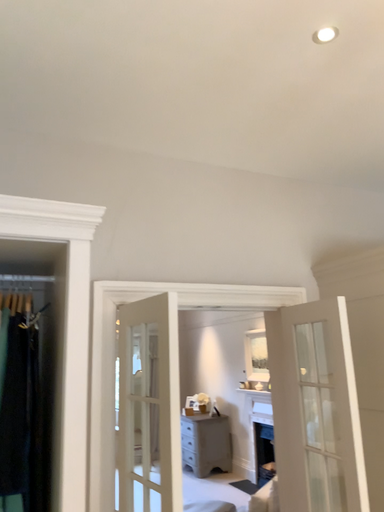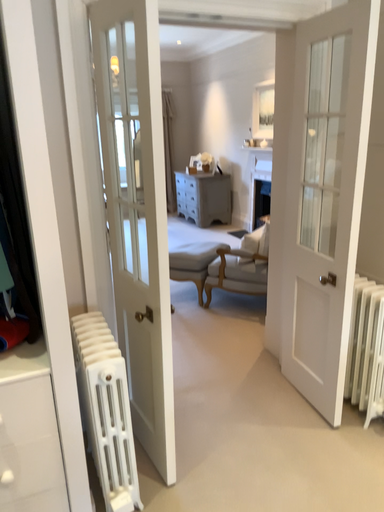
Question: How did the camera likely rotate when shooting the video?

Choices:
 (A) rotated downward
 (B) rotated upward

Answer: (A)